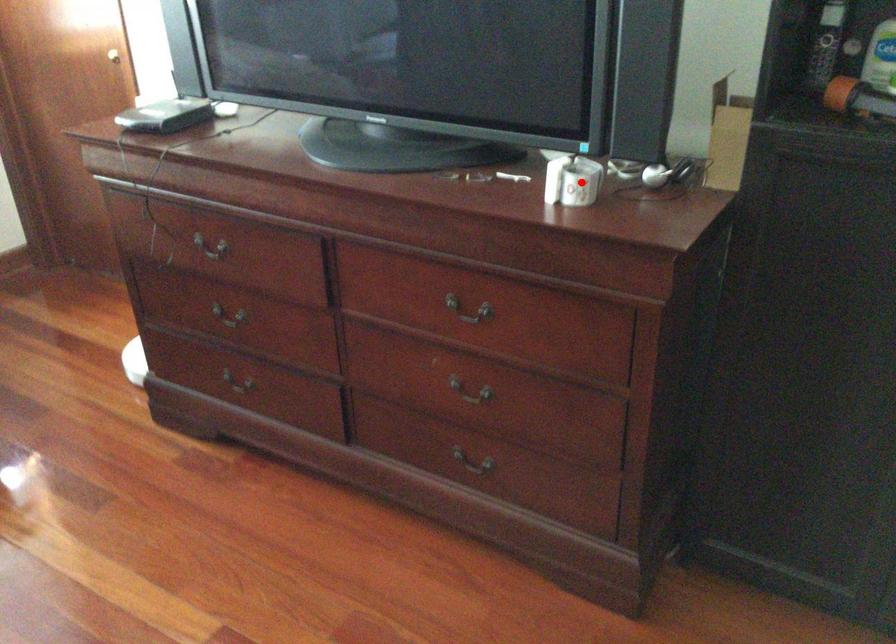
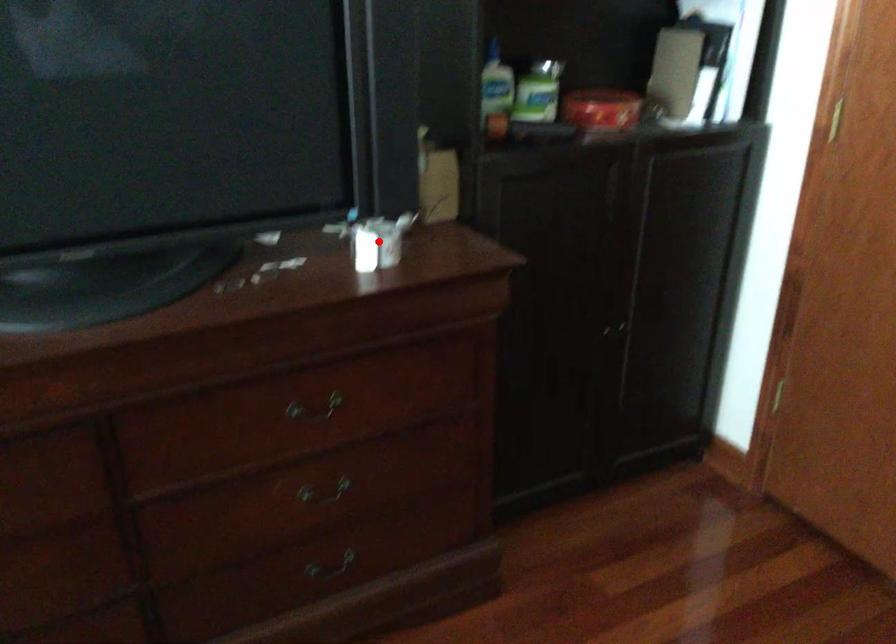
In the scene shown: I am providing you with two images of the same scene from different viewpoints. A red point is marked on the first image and another point is marked on the second image. Are the points marked in image1 and image2 representing the same 3D position?

Yes